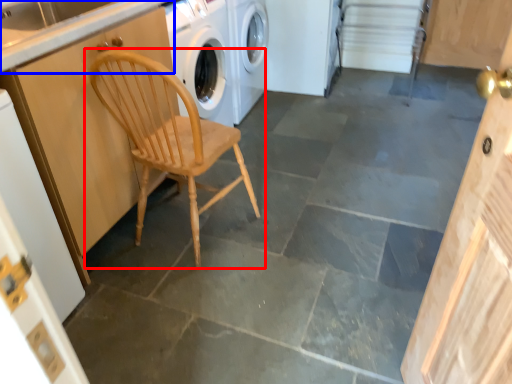
Question: Which of the following is the closest to the observer, chair (highlighted by a red box) or counter top (highlighted by a blue box)?

Choices:
 (A) chair
 (B) counter top

Answer: (A)